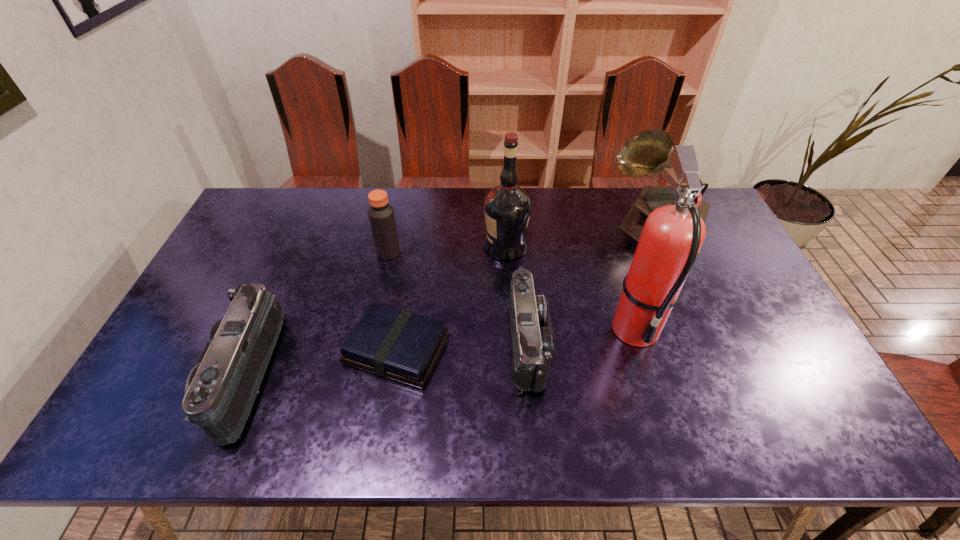
Considering the uniform spacing of camcorders, where should an additional camcorder be positioned on the right? Please locate a free spot. Please provide its 2D coordinates. Your answer should be formatted as a tuple, i.e. [(x, y)], where the tuple contains the x and y coordinates of a point satisfying the conditions above.

[(779, 316)]